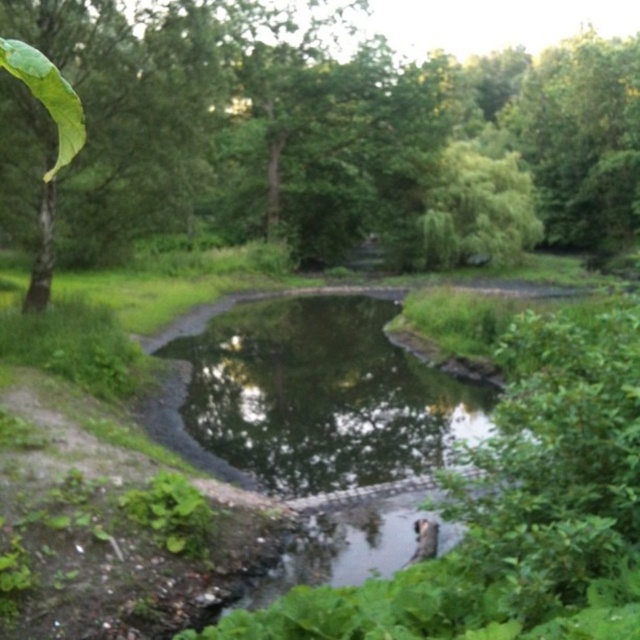
Question: Is green leafy tree at upper left positioned in front of transparent water at center?

Choices:
 (A) yes
 (B) no

Answer: (B)

Question: Which point is closer to the camera?

Choices:
 (A) transparent water at center
 (B) green leafy tree at upper left

Answer: (A)

Question: Is green leafy tree at upper left smaller than transparent water at center?

Choices:
 (A) yes
 (B) no

Answer: (B)

Question: Which point is farther to the camera?

Choices:
 (A) green leafy tree at upper left
 (B) transparent water at center

Answer: (A)

Question: Can you confirm if green leafy tree at upper left is wider than transparent water at center?

Choices:
 (A) yes
 (B) no

Answer: (A)